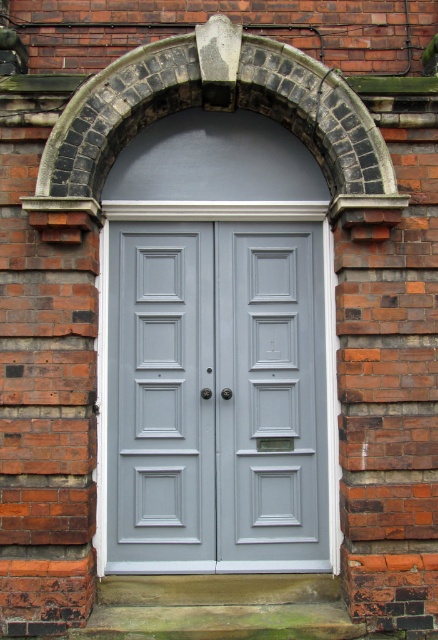
Question: Observing the image, what is the correct spatial positioning of satin gray door at center in reference to dark gray stone arch at center?

Choices:
 (A) right
 (B) left

Answer: (A)

Question: Observing the image, what is the correct spatial positioning of satin gray door at center in reference to dark gray stone arch at center?

Choices:
 (A) right
 (B) left

Answer: (A)

Question: Is satin gray door at center closer to camera compared to dark gray stone arch at center?

Choices:
 (A) yes
 (B) no

Answer: (B)